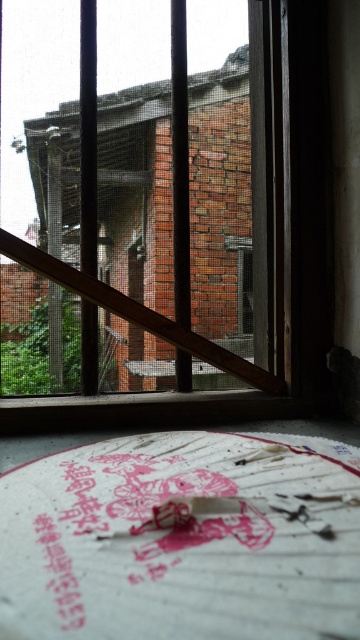
Who is positioned more to the left, brick wall at center or wooden at center?

brick wall at center

Which is in front, point (83, 266) or point (87, 376)?

Point (83, 266) is more forward.

Between point (83, 276) and point (264, 388), which one is positioned behind?

The point (264, 388) is more distant.

What are the coordinates of `brick wall at center` in the screenshot? It's located at (129, 300).